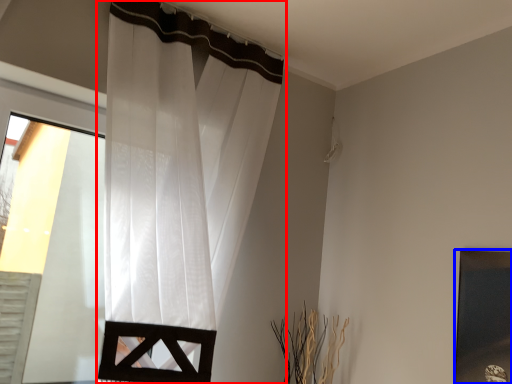
Question: Which object appears closest to the camera in this image, curtain (highlighted by a red box) or picture frame (highlighted by a blue box)?

Choices:
 (A) curtain
 (B) picture frame

Answer: (A)